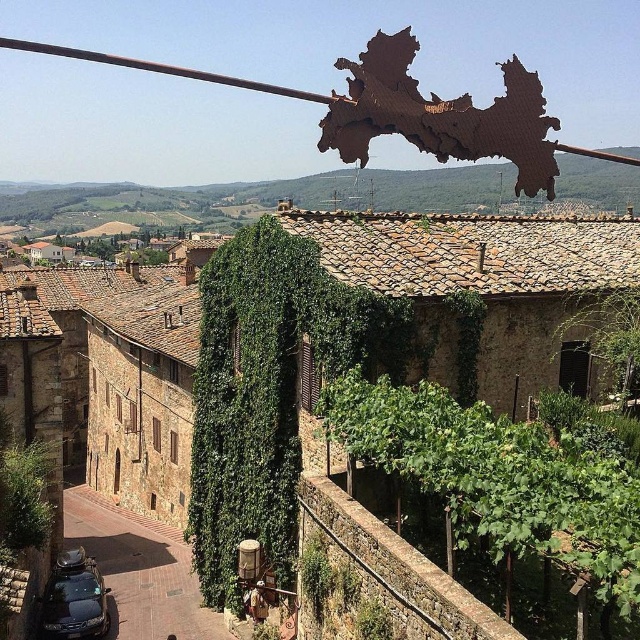
Can you confirm if brown stone town at center is smaller than dark gray asphalt at lower left?

No.

Between point (440, 310) and point (67, 499), which one is positioned in front?

Point (440, 310) is in front.

This screenshot has width=640, height=640. Identify the location of brown stone town at center. (106, 376).

Measure the distance between point (163, 564) and camera.

28.94 meters

Is dark gray asphalt at lower left wider than shiny black car at lower left?

Correct, the width of dark gray asphalt at lower left exceeds that of shiny black car at lower left.

Does point (186, 563) come farther from viewer compared to point (64, 621)?

Yes, it is.

In order to click on dark gray asphalt at lower left in this screenshot , I will do `click(140, 570)`.

Between green leafy ivy at lower right and shiny black car at lower left, which one has less height?

With less height is green leafy ivy at lower right.

Can you confirm if green leafy ivy at lower right is shorter than shiny black car at lower left?

Yes.

Between point (429, 490) and point (65, 618), which one is positioned behind?

Point (65, 618)

Find the location of a particular element. The image size is (640, 640). green leafy ivy at lower right is located at coordinates (500, 480).